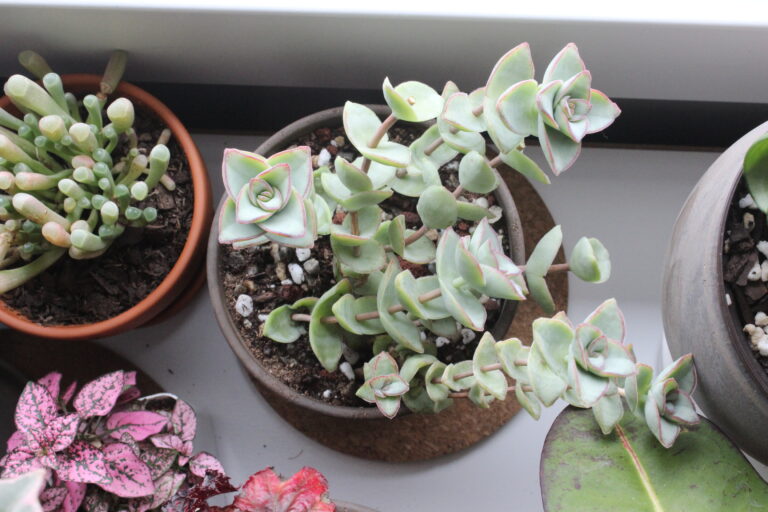
Locate an element on the screen. Image resolution: width=768 pixels, height=512 pixels. pot is located at coordinates (57, 327), (242, 353), (702, 289).